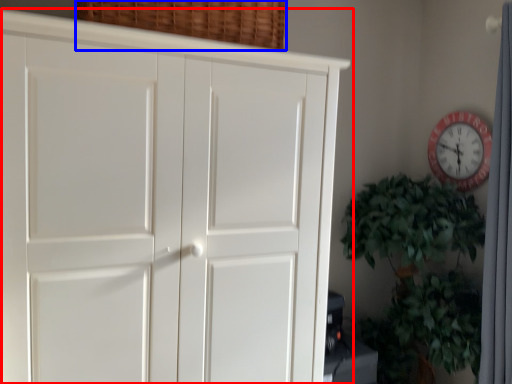
Question: Which object appears farthest to the camera in this image, cupboard (highlighted by a red box) or basket (highlighted by a blue box)?

Choices:
 (A) cupboard
 (B) basket

Answer: (B)